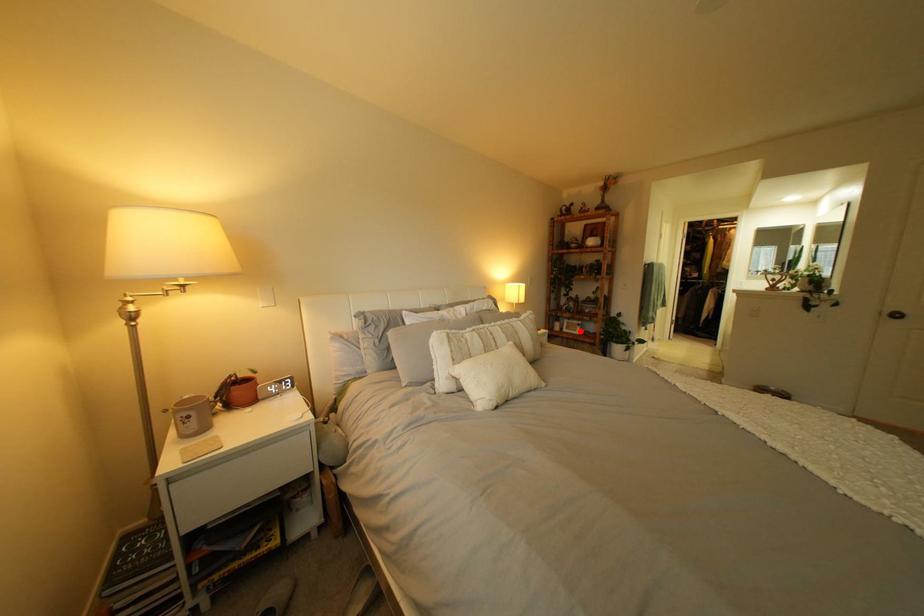
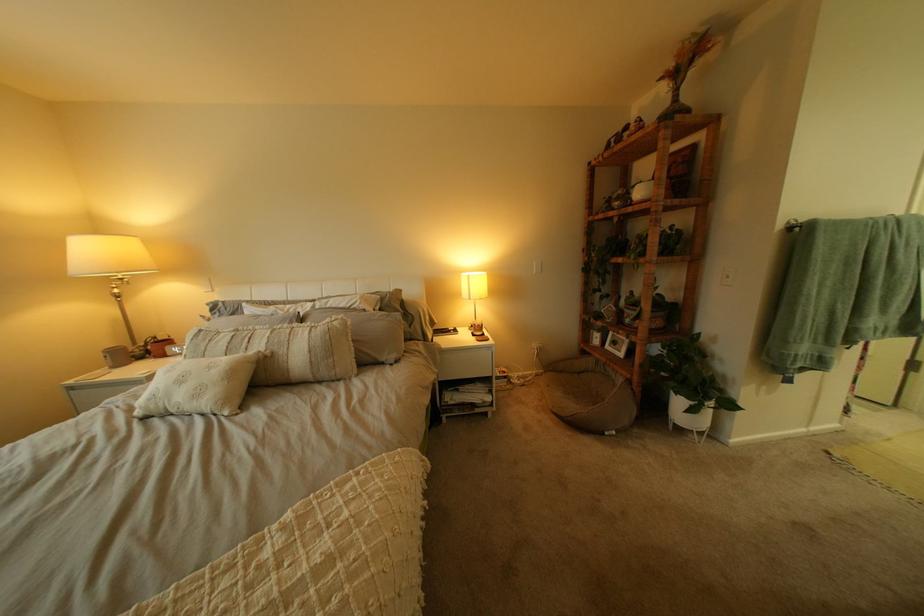
Find the pixel in the second image that matches the highlighted location in the first image.

(623, 347)